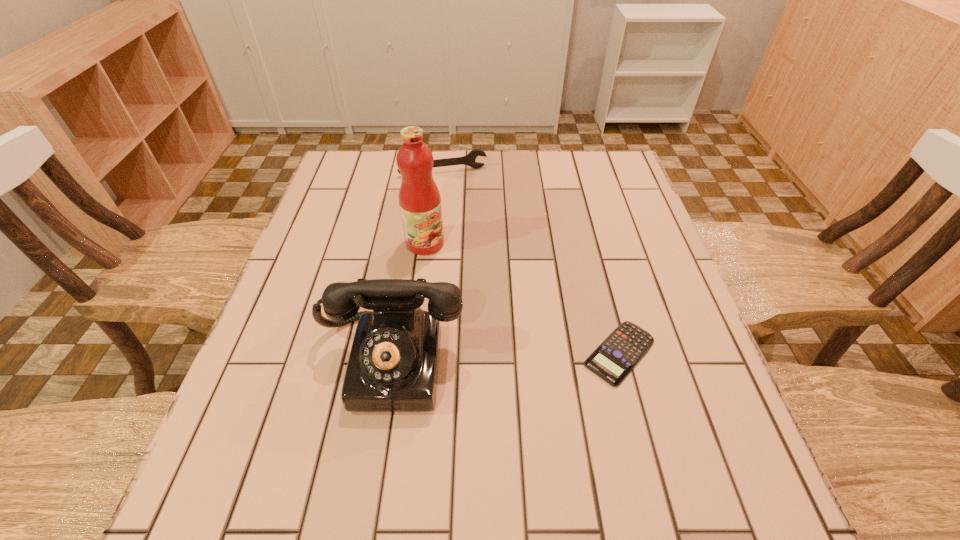
Locate an element on the screen. This screenshot has width=960, height=540. free space at the near edge is located at coordinates (600, 414).

You are a GUI agent. You are given a task and a screenshot of the screen. Output one action in this format:
    pyautogui.click(x=<x>, y=<y>)
    Task: Click on the free space at the left edge of the desktop
    Image resolution: width=960 pixels, height=540 pixels.
    Given the screenshot: What is the action you would take?
    pyautogui.click(x=327, y=247)

In the image, there is a desktop. Identify the location of vacant space at the right edge. coord(588,211).

Find the location of `free region at the far left corner of the desktop`. free region at the far left corner of the desktop is located at coordinates (373, 154).

Image resolution: width=960 pixels, height=540 pixels. I want to click on vacant space at the near left corner of the desktop, so click(265, 427).

Image resolution: width=960 pixels, height=540 pixels. In the image, there is a desktop. Find the location of `vacant space at the far right corner`. vacant space at the far right corner is located at coordinates (598, 176).

Identify the location of vacant area that lies between the farthest object and the rightmost object. The width and height of the screenshot is (960, 540). (531, 262).

Locate an element on the screen. Image resolution: width=960 pixels, height=540 pixels. unoccupied area between the calculator and the farthest object is located at coordinates (531, 262).

The width and height of the screenshot is (960, 540). I want to click on empty space that is in between the fruit juice and the calculator, so click(522, 298).

Where is `vacant region between the farthest object and the rightmost object`? The height and width of the screenshot is (540, 960). vacant region between the farthest object and the rightmost object is located at coordinates 531,262.